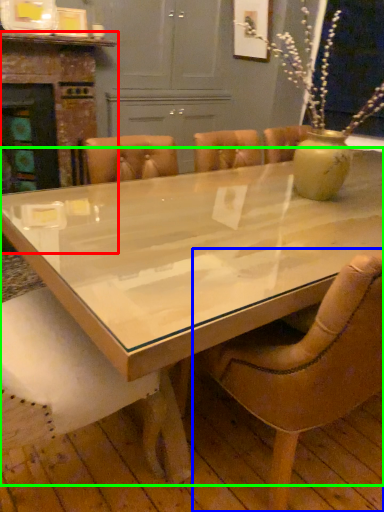
Question: Based on their relative distances, which object is nearer to fireplace (highlighted by a red box)? Choose from chair (highlighted by a blue box) and coffee table (highlighted by a green box).

Choices:
 (A) chair
 (B) coffee table

Answer: (B)